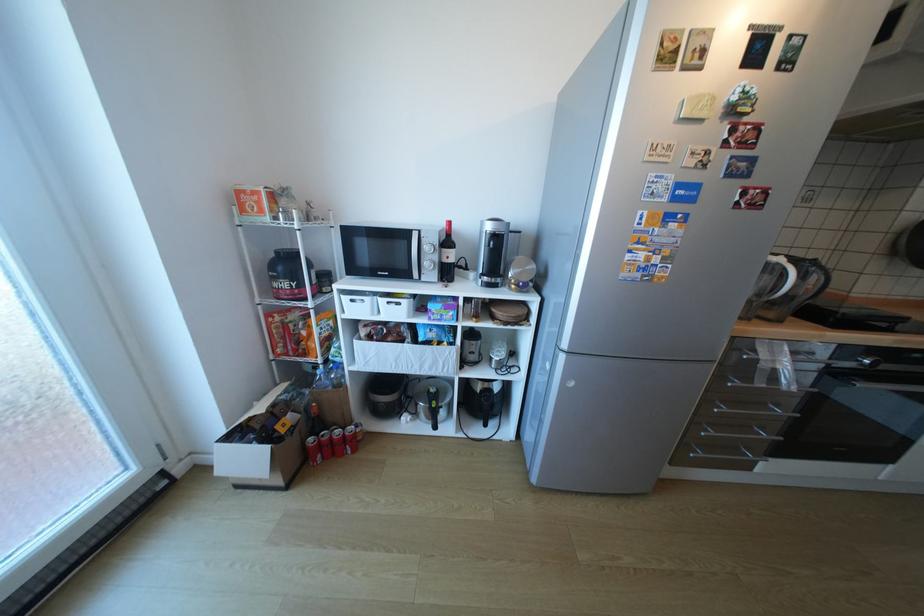
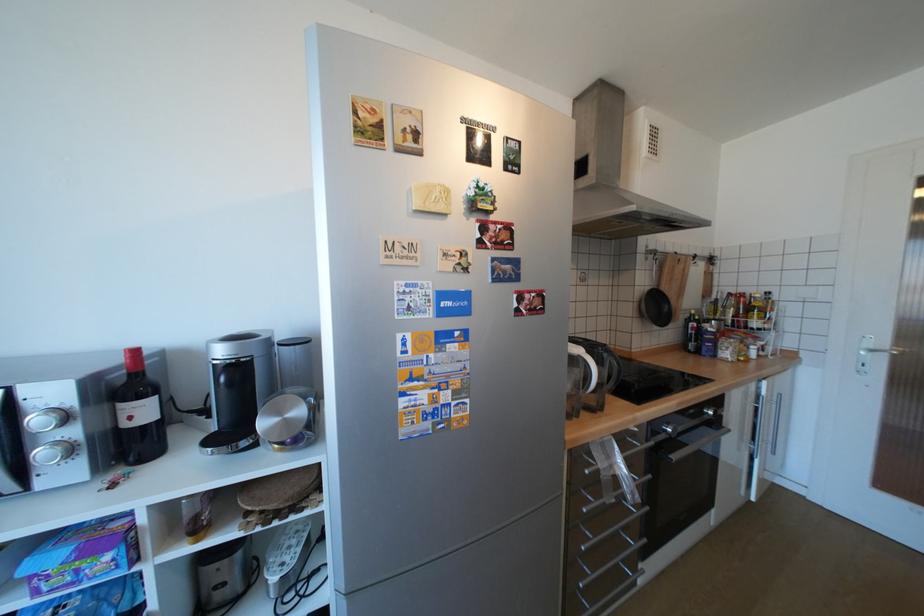
Locate, in the second image, the point that corresponds to (447,317) in the first image.

(79, 578)